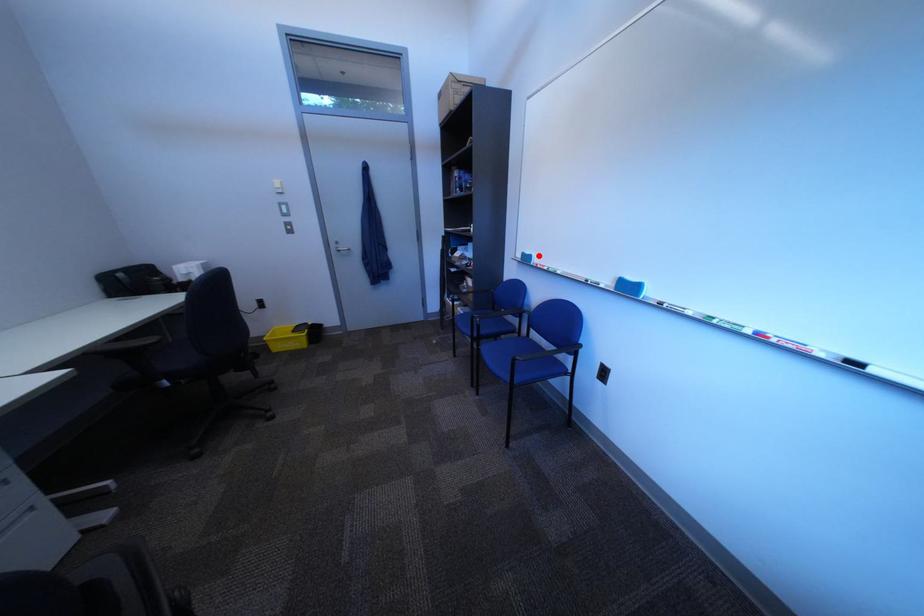
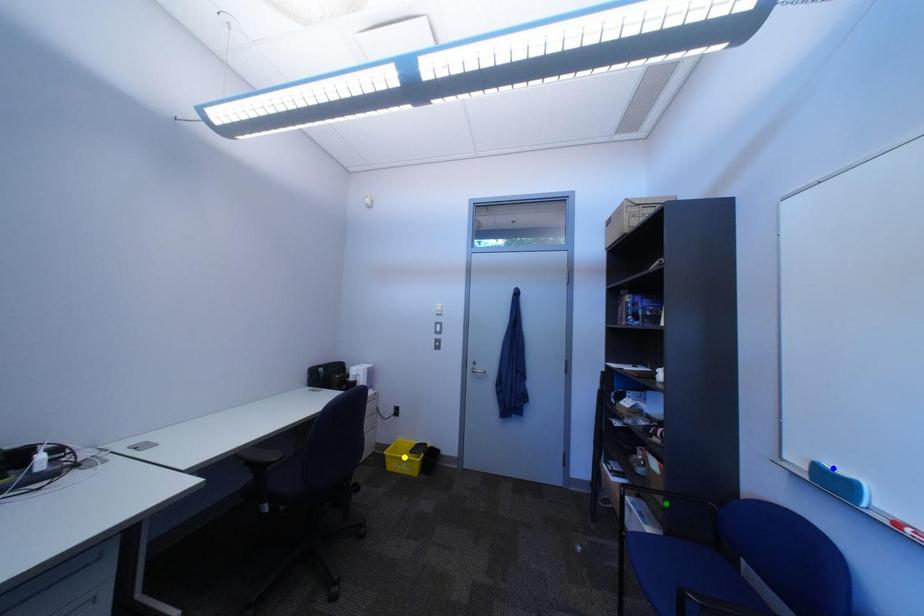
Question: I am providing you with two images of the same scene from different viewpoints. A red point is marked on the first image. You are given multiple points on the second image. Which point in image 2 is actually the same real-world point as the red point in image 1?

Choices:
 (A) green point
 (B) yellow point
 (C) blue point

Answer: (C)